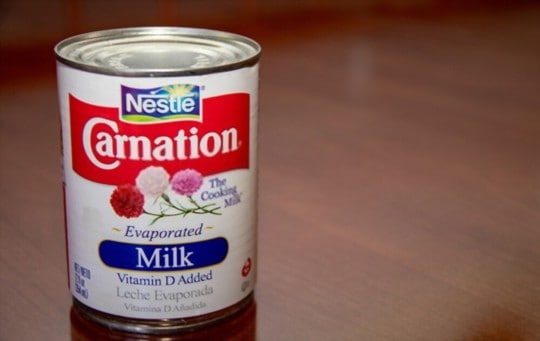
I want to click on table, so click(353, 315).